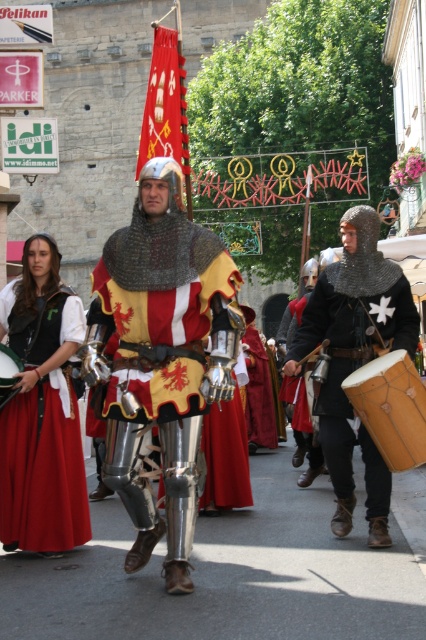
Question: Among these objects, which one is nearest to the camera?

Choices:
 (A) wooden drum at center
 (B) metallic chainmail helmet at center

Answer: (B)

Question: Which of the following is the closest to the observer?

Choices:
 (A) (402, 369)
 (B) (11, 378)
 (C) (224, 330)

Answer: (A)

Question: Can you confirm if metallic chainmail helmet at center is bigger than matte red skirt at center?

Choices:
 (A) yes
 (B) no

Answer: (A)

Question: Is metallic chainmail armor at center to the right of wooden drum at center from the viewer's perspective?

Choices:
 (A) no
 (B) yes

Answer: (B)

Question: Can you confirm if metallic chainmail armor at center is thinner than matte red skirt at center?

Choices:
 (A) yes
 (B) no

Answer: (B)

Question: Which object is farther from the camera taking this photo?

Choices:
 (A) metallic chainmail helmet at center
 (B) shiny silver armor at center

Answer: (A)